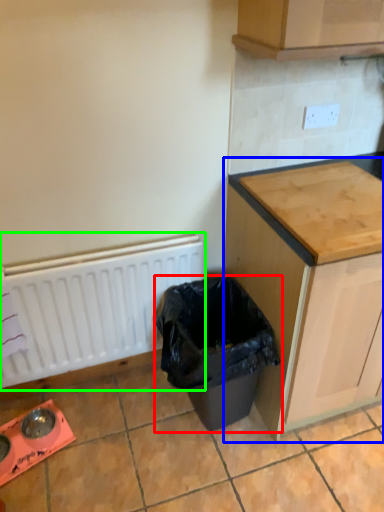
Question: Based on their relative distances, which object is nearer to waste container (highlighted by a red box)? Choose from cabinetry (highlighted by a blue box) and radiator (highlighted by a green box).

Choices:
 (A) cabinetry
 (B) radiator

Answer: (A)